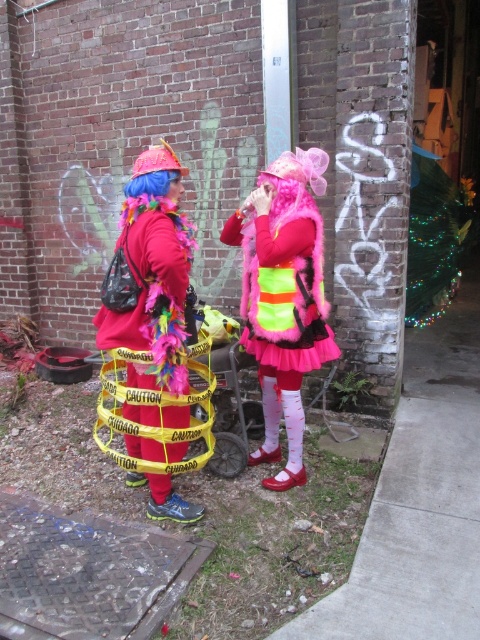
Question: Considering the relative positions of neon yellow fabric skirt at center and shiny metallic hoop at center in the image provided, where is neon yellow fabric skirt at center located with respect to shiny metallic hoop at center?

Choices:
 (A) left
 (B) right

Answer: (B)

Question: Is neon yellow fabric skirt at center bigger than shiny metallic hoop at center?

Choices:
 (A) yes
 (B) no

Answer: (A)

Question: Which point is closer to the camera?

Choices:
 (A) (280, 365)
 (B) (131, 376)

Answer: (B)

Question: Which object is closer to the camera taking this photo?

Choices:
 (A) neon yellow fabric skirt at center
 (B) shiny metallic hoop at center

Answer: (B)

Question: Is neon yellow fabric skirt at center closer to the viewer compared to shiny metallic hoop at center?

Choices:
 (A) no
 (B) yes

Answer: (A)